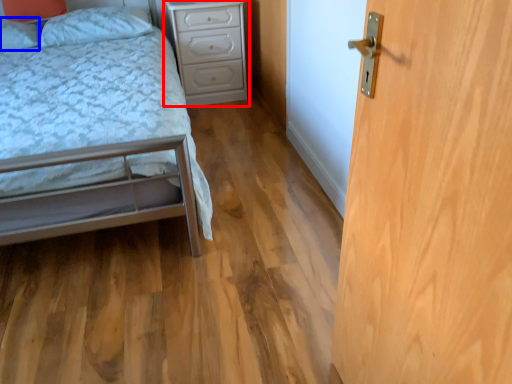
Question: Which object appears closest to the camera in this image, nightstand (highlighted by a red box) or pillow (highlighted by a blue box)?

Choices:
 (A) nightstand
 (B) pillow

Answer: (B)